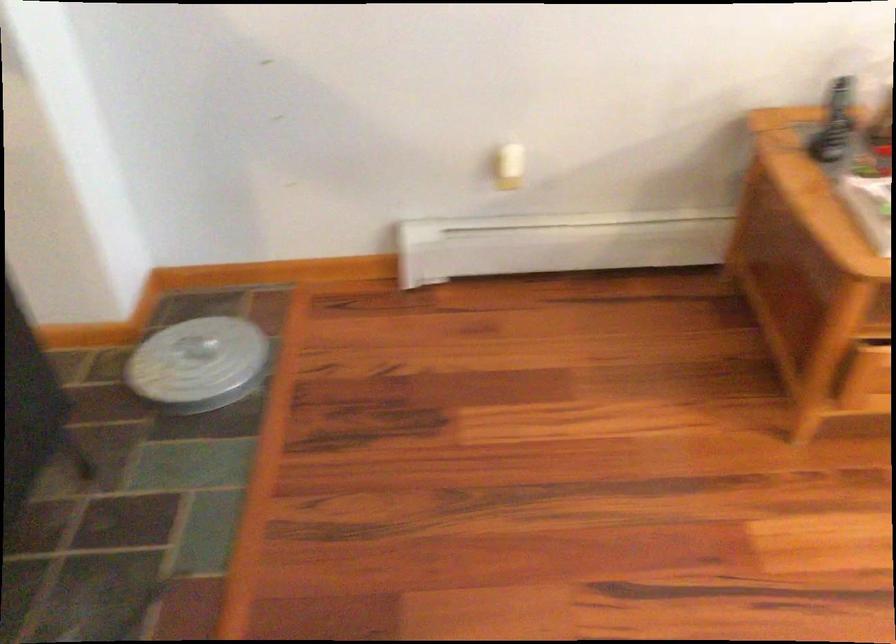
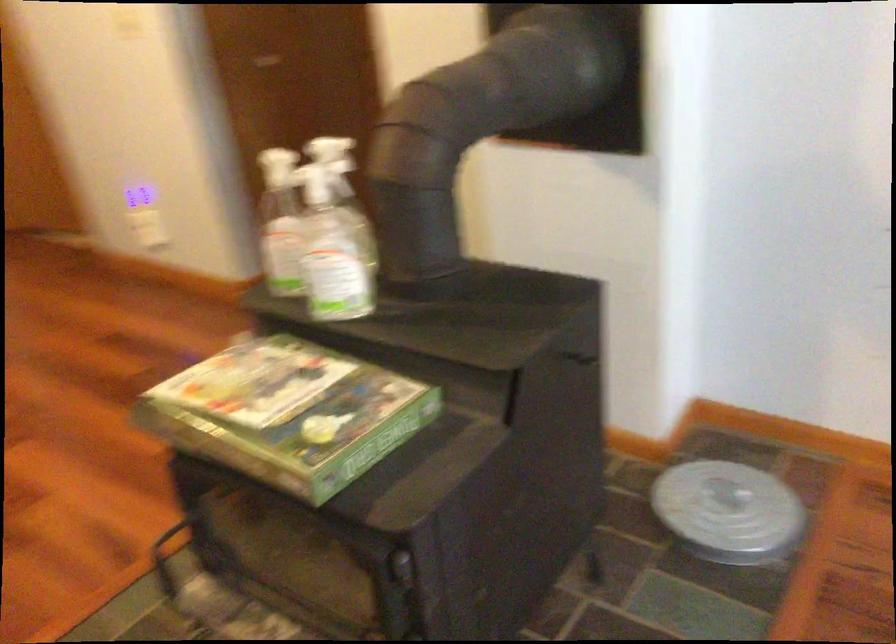
Locate, in the second image, the point that corresponds to point 211,365 in the first image.

(728, 512)